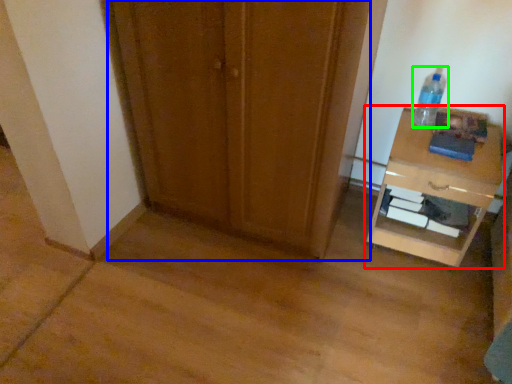
Question: Based on their relative distances, which object is nearer to nightstand (highlighted by a red box)? Choose from door (highlighted by a blue box) and bottle (highlighted by a green box).

Choices:
 (A) door
 (B) bottle

Answer: (B)